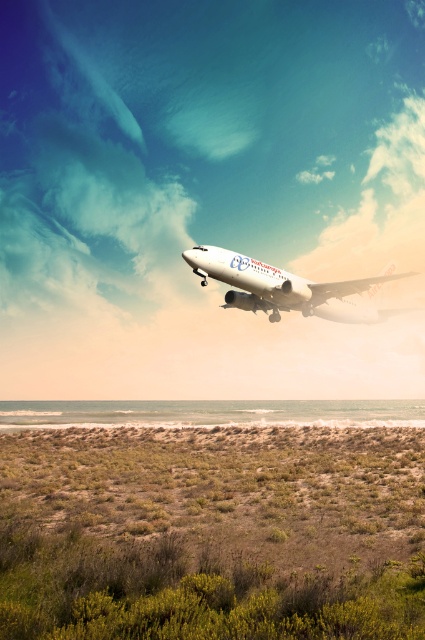
You are a pilot preparing for takeoff and notice the green shrubbery at lower center and the white glossy airplane at upper center in your view. Which object appears wider from your perspective?

The green shrubbery at lower center appears wider than the white glossy airplane at upper center because its width surpasses the airplane.

You are a pilot observing the Air Europa airplane in mid flight. You notice a green shrubbery at lower center and a white glossy airplane at upper center. Which object is located higher in the image?

The white glossy airplane at upper center is higher in the image than the green shrubbery at lower center.